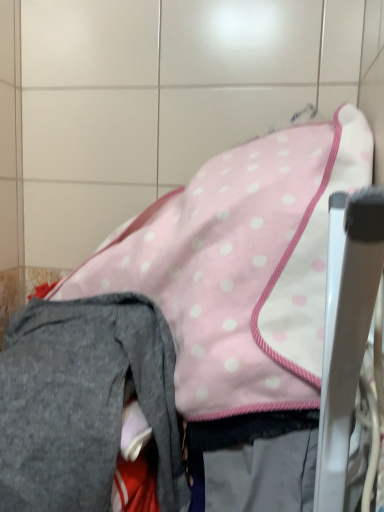
Question: Is gray fleece pants at lower left bigger than metallic silver chair at right?

Choices:
 (A) yes
 (B) no

Answer: (A)

Question: Does gray fleece pants at lower left have a smaller size compared to metallic silver chair at right?

Choices:
 (A) no
 (B) yes

Answer: (A)

Question: From a real-world perspective, is gray fleece pants at lower left on top of metallic silver chair at right?

Choices:
 (A) yes
 (B) no

Answer: (B)

Question: From a real-world perspective, is gray fleece pants at lower left positioned under metallic silver chair at right based on gravity?

Choices:
 (A) yes
 (B) no

Answer: (A)

Question: From the image's perspective, would you say gray fleece pants at lower left is positioned over metallic silver chair at right?

Choices:
 (A) no
 (B) yes

Answer: (A)

Question: In terms of width, does metallic silver chair at right look wider or thinner when compared to pink polka dot fabric at center?

Choices:
 (A) thin
 (B) wide

Answer: (A)

Question: From a real-world perspective, is metallic silver chair at right positioned above or below pink polka dot fabric at center?

Choices:
 (A) above
 (B) below

Answer: (B)

Question: From the image's perspective, is metallic silver chair at right located above or below pink polka dot fabric at center?

Choices:
 (A) below
 (B) above

Answer: (A)

Question: Would you say metallic silver chair at right is inside or outside pink polka dot fabric at center?

Choices:
 (A) inside
 (B) outside

Answer: (B)

Question: In the image, is gray fleece pants at lower left positioned in front of or behind pink polka dot fabric at center?

Choices:
 (A) behind
 (B) front

Answer: (B)

Question: Which is correct: gray fleece pants at lower left is inside pink polka dot fabric at center, or outside of it?

Choices:
 (A) outside
 (B) inside

Answer: (A)

Question: From a real-world perspective, is gray fleece pants at lower left positioned above or below pink polka dot fabric at center?

Choices:
 (A) below
 (B) above

Answer: (A)

Question: Looking at their shapes, would you say gray fleece pants at lower left is wider or thinner than pink polka dot fabric at center?

Choices:
 (A) wide
 (B) thin

Answer: (A)

Question: Based on their sizes in the image, would you say gray fleece pants at lower left is bigger or smaller than metallic silver chair at right?

Choices:
 (A) big
 (B) small

Answer: (A)

Question: Considering the positions of gray fleece pants at lower left and metallic silver chair at right in the image, is gray fleece pants at lower left wider or thinner than metallic silver chair at right?

Choices:
 (A) thin
 (B) wide

Answer: (B)